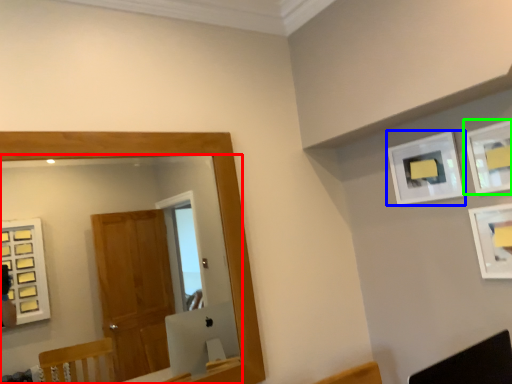
Question: Considering the real-world distances, which object is farthest from mirror (highlighted by a red box)? picture frame (highlighted by a blue box) or picture frame (highlighted by a green box)?

Choices:
 (A) picture frame
 (B) picture frame

Answer: (B)